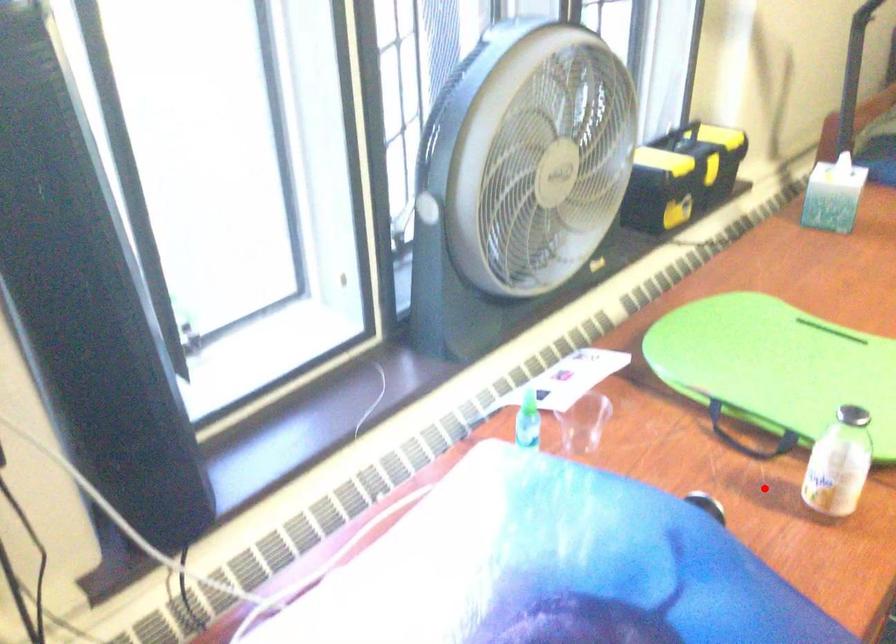
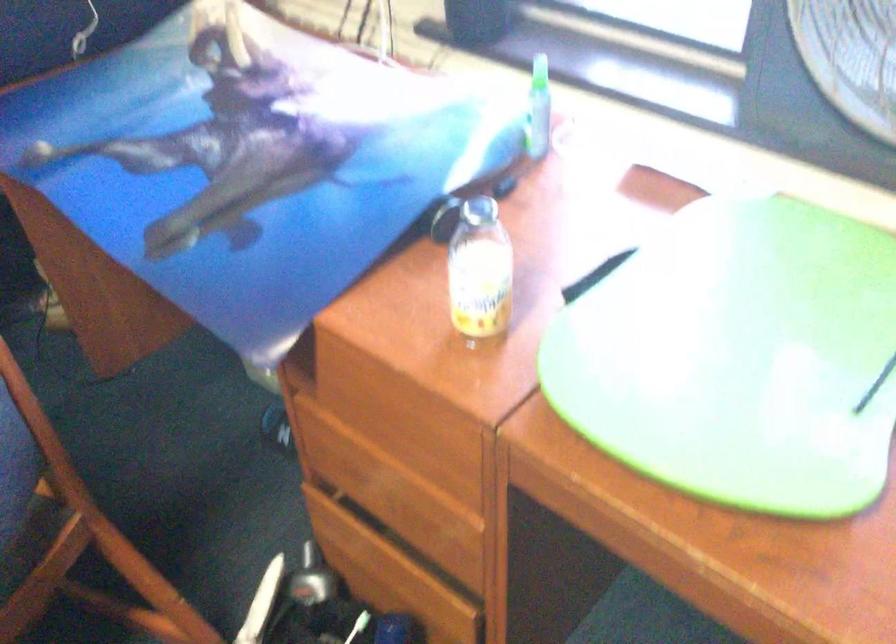
Question: I am providing you with two images of the same scene from different viewpoints. A red point is marked on the first image. Can you still see the location of the red point in image 2?

Choices:
 (A) Yes
 (B) No

Answer: (A)